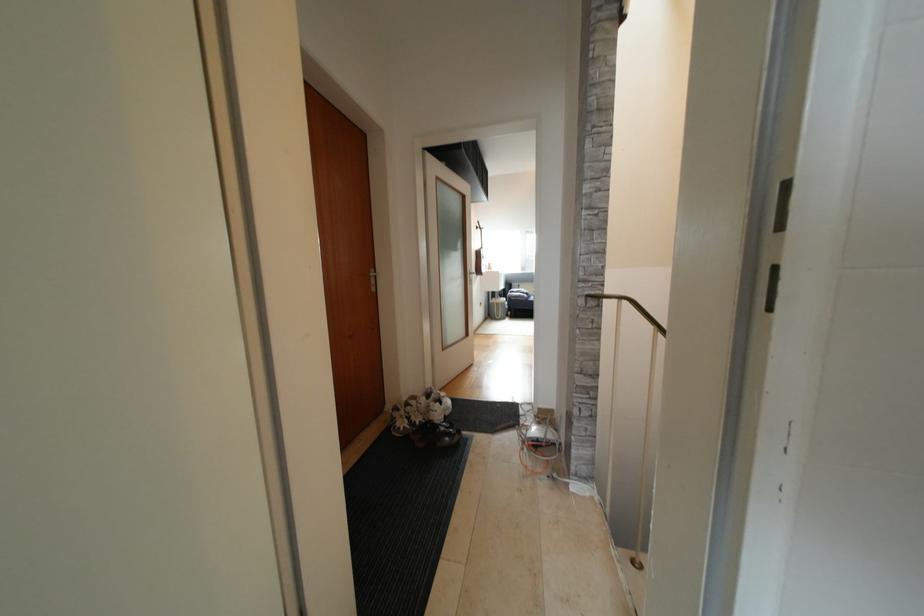
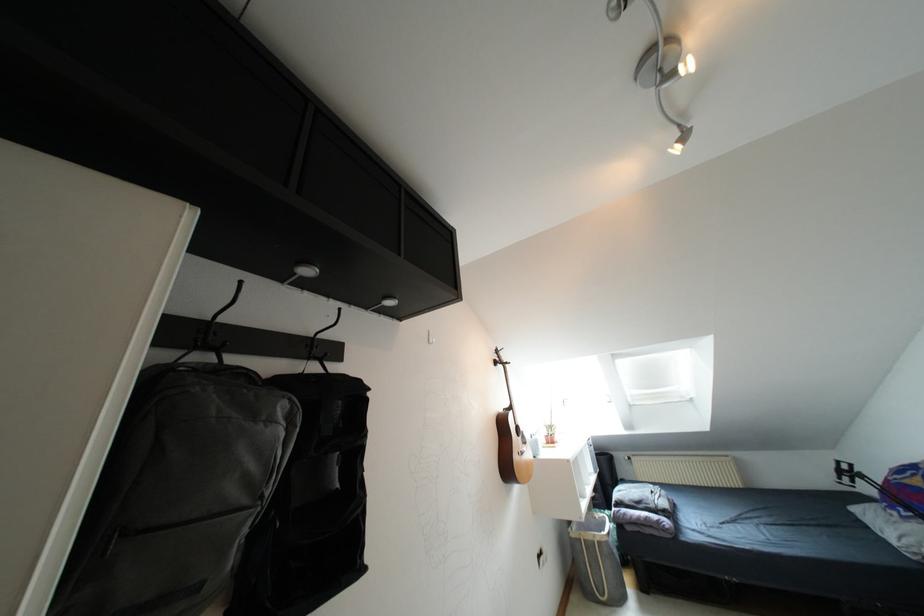
Where in the second image is the point corresponding to point (489, 268) from the first image?

(550, 440)